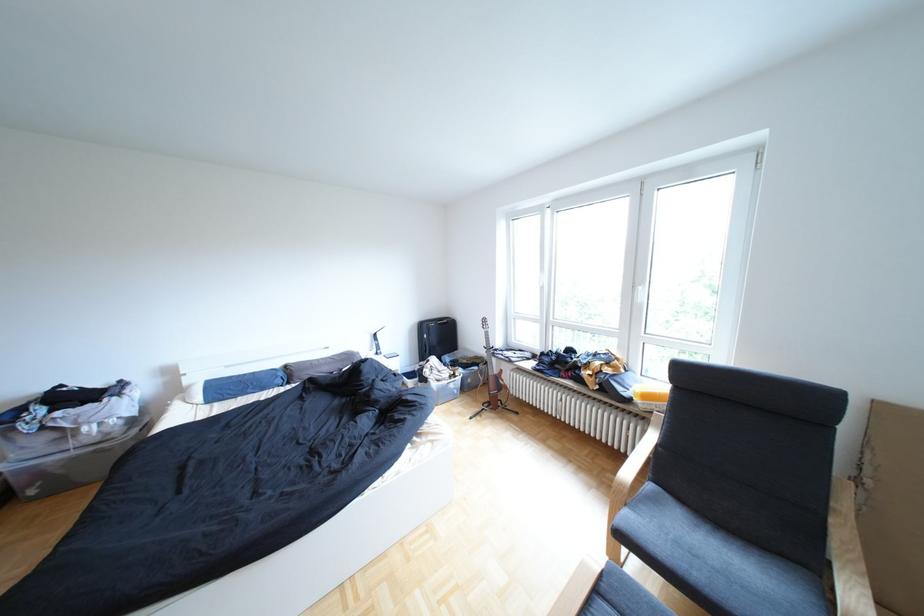
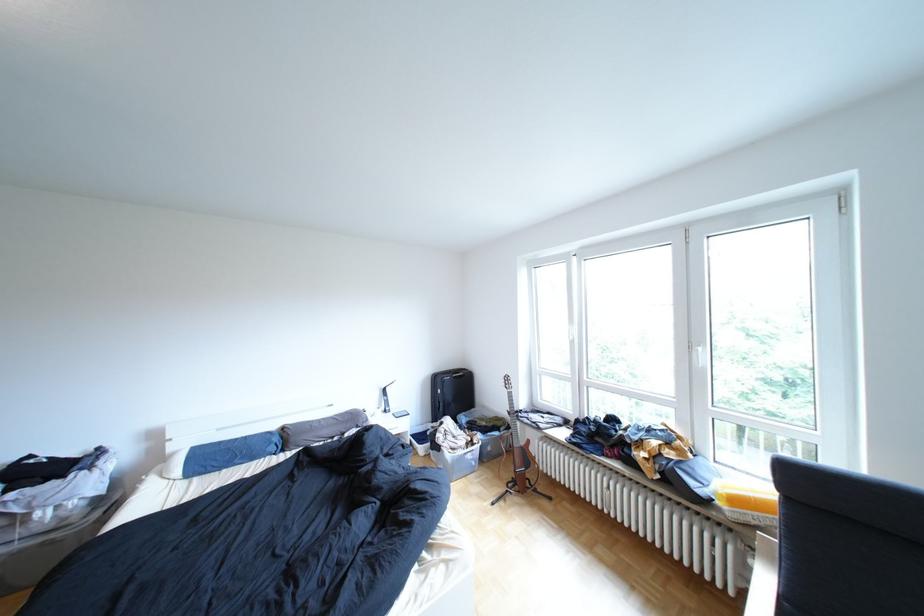
Where in the second image is the point corresponding to the point at 293,365 from the first image?

(289, 427)